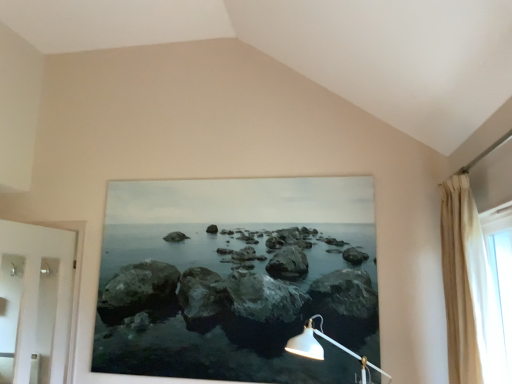
Question: From the image's perspective, is white glossy door at left above or below translucent fabric curtain at right?

Choices:
 (A) below
 (B) above

Answer: (A)

Question: Considering the positions of white glossy door at left and translucent fabric curtain at right in the image, is white glossy door at left bigger or smaller than translucent fabric curtain at right?

Choices:
 (A) big
 (B) small

Answer: (A)

Question: Which object is positioned farthest from the beige fabric curtain at right?

Choices:
 (A) white glossy door at left
 (B) translucent fabric curtain at right

Answer: (A)

Question: Which object is the farthest from the beige fabric curtain at right?

Choices:
 (A) translucent fabric curtain at right
 (B) white glossy door at left

Answer: (B)